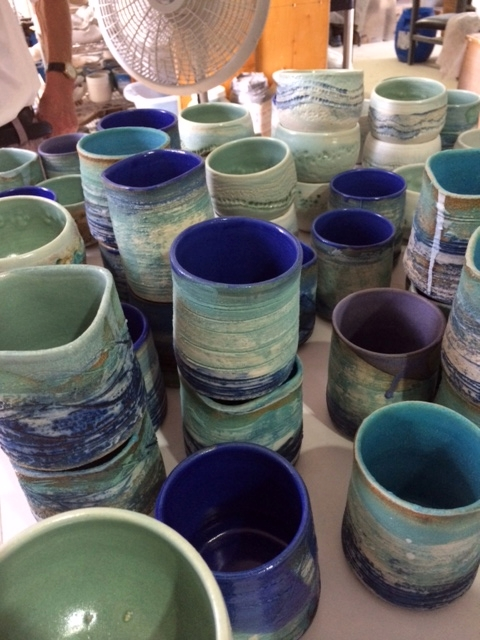
At what (x,y) coordinates should I click in order to perform the action: click on purple cups. Please return your answer as a coordinate pair (x, y). This screenshot has width=480, height=640. Looking at the image, I should click on (46, 152), (359, 315).